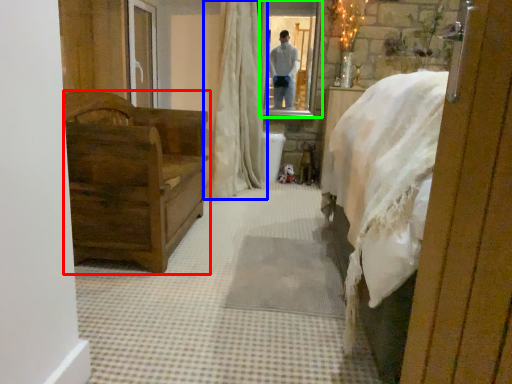
Question: Considering the real-world distances, which object is closest to furniture (highlighted by a red box)? curtain (highlighted by a blue box) or mirror (highlighted by a green box).

Choices:
 (A) curtain
 (B) mirror

Answer: (A)